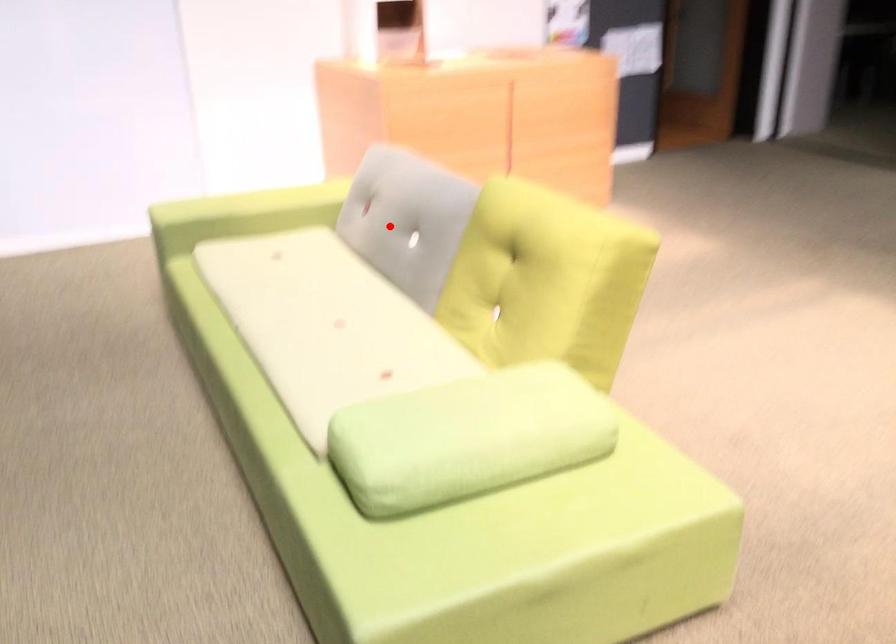
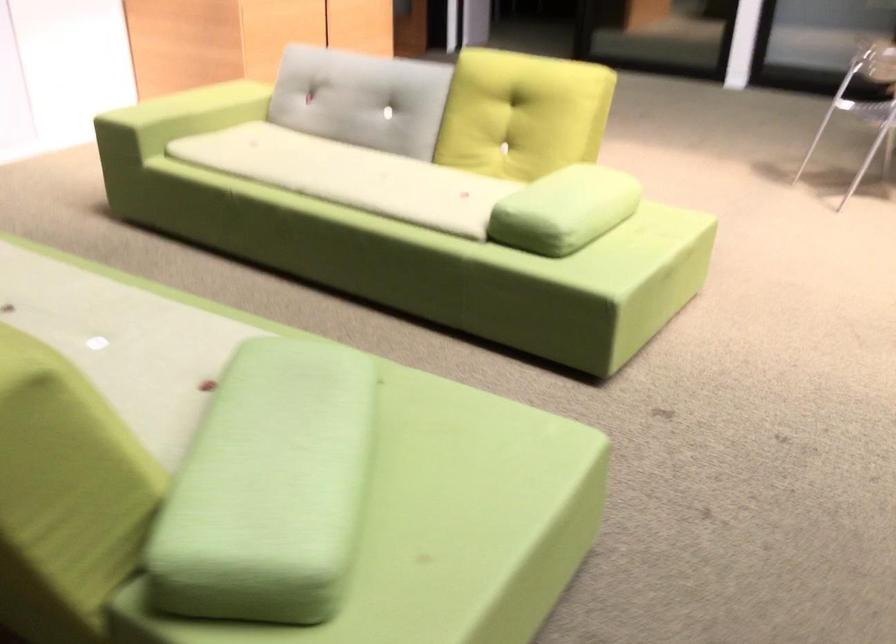
Find the pixel in the second image that matches the highlighted location in the first image.

(362, 99)